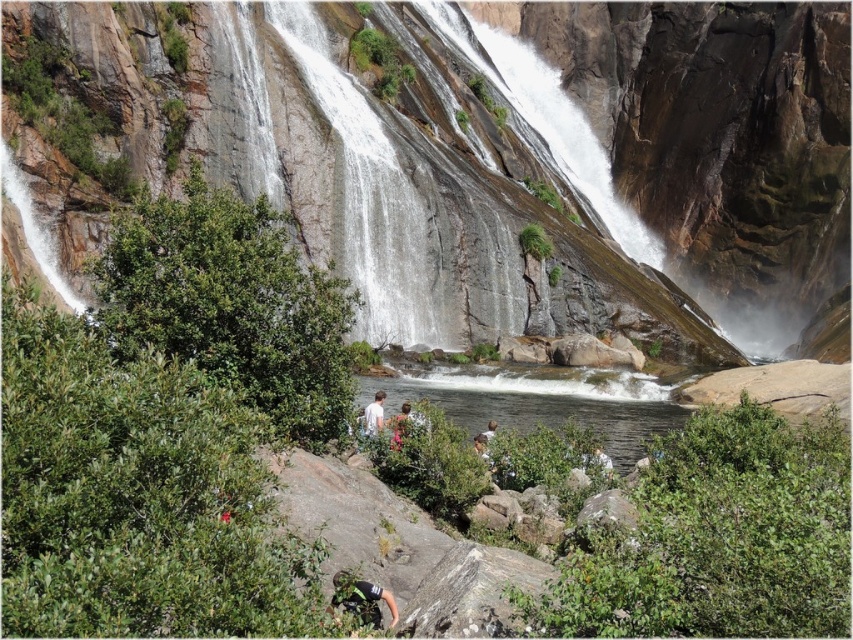
Who is shorter, clear water at center or green climbing harness at lower center?

green climbing harness at lower center is shorter.

Does clear water at center have a lesser height compared to green climbing harness at lower center?

In fact, clear water at center may be taller than green climbing harness at lower center.

Which is in front, point (664, 392) or point (363, 608)?

Point (363, 608) is more forward.

The image size is (853, 640). Identify the location of clear water at center. (541, 403).

Can you confirm if clear water at center is taller than white matte shirt at center?

Correct, clear water at center is much taller as white matte shirt at center.

Which is in front, point (520, 412) or point (367, 412)?

Point (367, 412) is more forward.

The image size is (853, 640). I want to click on clear water at center, so click(x=541, y=403).

Can you confirm if clear water at center is smaller than green fabric shirt at center?

No.

Is clear water at center to the right of green fabric shirt at center from the viewer's perspective?

Indeed, clear water at center is positioned on the right side of green fabric shirt at center.

Image resolution: width=853 pixels, height=640 pixels. I want to click on clear water at center, so click(x=541, y=403).